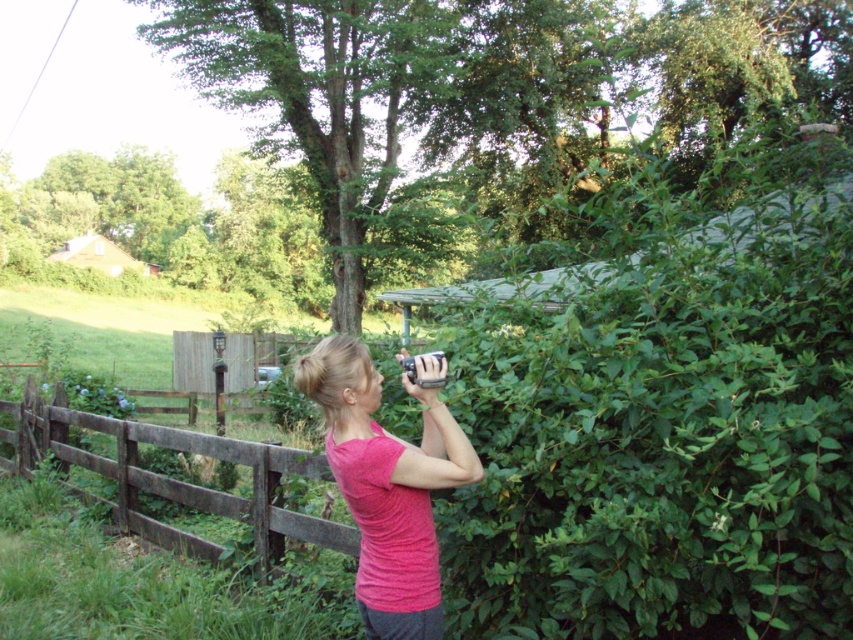
Is brown wooden fence at left in front of metallic silver camera at upper center?

No.

Is brown wooden fence at left below metallic silver camera at upper center?

Yes, brown wooden fence at left is below metallic silver camera at upper center.

Is point (117, 440) positioned behind point (440, 358)?

Yes, it is.

Find the location of `brown wooden fence at left`. brown wooden fence at left is located at coordinates (173, 477).

You are a GUI agent. You are given a task and a screenshot of the screen. Output one action in this format:
    pyautogui.click(x=<x>, y=<y>)
    Task: Click on the pink fabric shirt at center
    Image resolution: width=853 pixels, height=640 pixels.
    Given the screenshot: What is the action you would take?
    pyautogui.click(x=386, y=484)

Between pink fabric shirt at center and brown wooden fence at left, which one has less height?

With less height is brown wooden fence at left.

Between point (386, 515) and point (131, 496), which one is positioned behind?

The point (131, 496) is more distant.

Identify the location of pink fabric shirt at center. (386, 484).

Is the position of pink fabric shirt at center more distant than that of metallic silver camera at upper center?

No.

Does pink fabric shirt at center appear on the left side of metallic silver camera at upper center?

Indeed, pink fabric shirt at center is positioned on the left side of metallic silver camera at upper center.

Looking at this image, who is more distant from viewer, (457, 436) or (409, 378)?

Point (409, 378)

At what (x,y) coordinates should I click in order to perform the action: click on pink fabric shirt at center. Please return your answer as a coordinate pair (x, y). The height and width of the screenshot is (640, 853). Looking at the image, I should click on (386, 484).